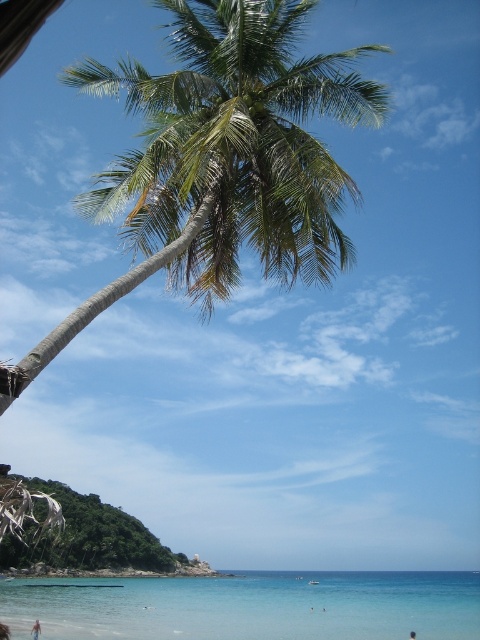
You are standing on the beach and see the clear blue water at lower center and the black hair at lower center. Which object is closer to your left side?

The clear blue water at lower center is closer to your left side because it is positioned to the left of the black hair at lower center.

You are a photographer planning to take a photo of the beach scene. You want to ensure both the green leafy palm tree at upper center and the black hair at lower center are clearly visible in the frame. Considering their sizes, which object might require you to adjust your camera focus more carefully to ensure clarity?

The black hair at lower center might require more careful focus adjustment because it is smaller in size compared to the green leafy palm tree at upper center.